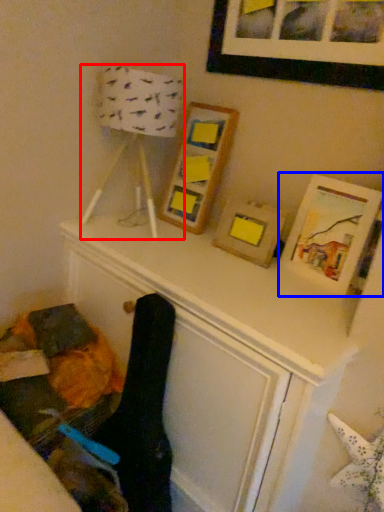
Question: Among these objects, which one is nearest to the camera, table lamp (highlighted by a red box) or picture frame (highlighted by a blue box)?

Choices:
 (A) table lamp
 (B) picture frame

Answer: (B)